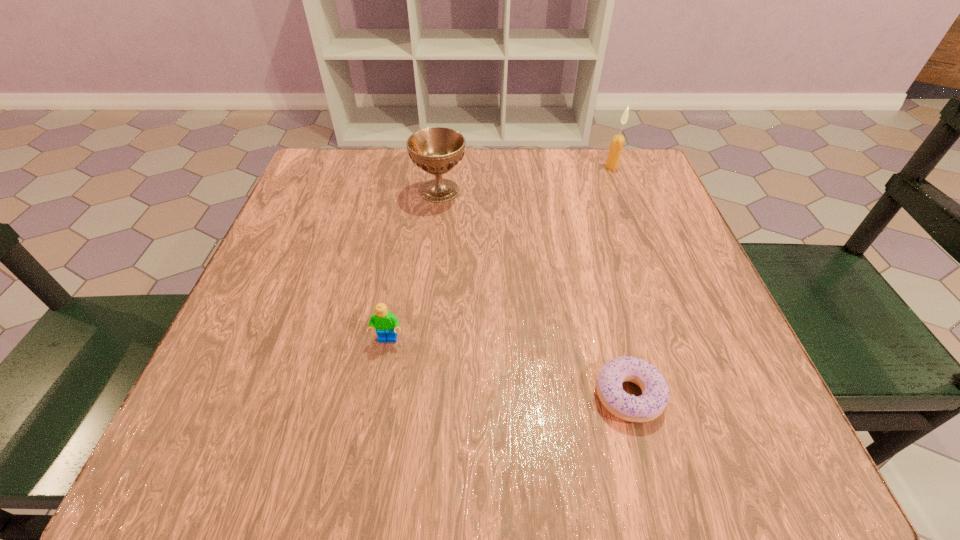
Locate an element on the screen. vacant space positioned on the face of the third farthest object is located at coordinates (370, 442).

The image size is (960, 540). Find the location of `free space located on the right of the second object from right to left`. free space located on the right of the second object from right to left is located at coordinates (723, 395).

At what (x,y) coordinates should I click in order to perform the action: click on candle present at the far edge. Please return your answer as a coordinate pair (x, y). The image size is (960, 540). Looking at the image, I should click on (616, 146).

The width and height of the screenshot is (960, 540). In order to click on chalice located at the far edge in this screenshot , I will do `click(436, 150)`.

At what (x,y) coordinates should I click in order to perform the action: click on object positioned at the near edge. Please return your answer as a coordinate pair (x, y). The image size is (960, 540). Looking at the image, I should click on (x=655, y=391).

Identify the location of candle present at the right edge. Image resolution: width=960 pixels, height=540 pixels. (616, 146).

The width and height of the screenshot is (960, 540). I want to click on doughnut that is positioned at the right edge, so click(655, 391).

You are a GUI agent. You are given a task and a screenshot of the screen. Output one action in this format:
    pyautogui.click(x=<x>, y=<y>)
    Task: Click on the object present at the far right corner
    The width and height of the screenshot is (960, 540).
    Given the screenshot: What is the action you would take?
    pyautogui.click(x=616, y=146)

What are the coordinates of `object present at the near right corner` in the screenshot? It's located at (655, 391).

Where is `vacant space at the far edge`? vacant space at the far edge is located at coordinates (551, 174).